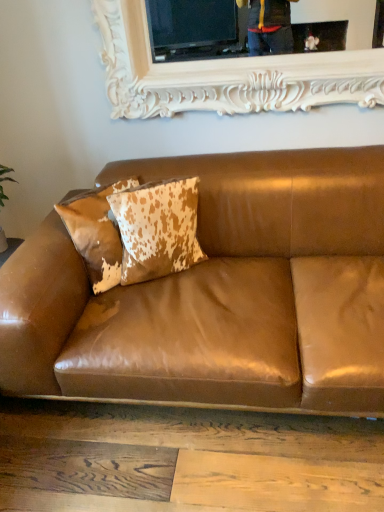
Question: Is there a large distance between cowhide pillow at upper left, acting as the 2th pillow starting from the left, and cowhide pillow at center, which is counted as the first pillow, starting from the left?

Choices:
 (A) no
 (B) yes

Answer: (A)

Question: Is cowhide pillow at upper left, the 1th pillow when ordered from right to left, next to cowhide pillow at center, which is counted as the first pillow, starting from the left, and touching it?

Choices:
 (A) yes
 (B) no

Answer: (B)

Question: Is cowhide pillow at upper left, the 1th pillow when ordered from right to left, facing towards cowhide pillow at center, which is counted as the first pillow, starting from the left?

Choices:
 (A) no
 (B) yes

Answer: (A)

Question: Is cowhide pillow at upper left, the 1th pillow when ordered from right to left, looking in the opposite direction of cowhide pillow at center, marked as the 2th pillow in a right-to-left arrangement?

Choices:
 (A) no
 (B) yes

Answer: (B)

Question: Does cowhide pillow at upper left, acting as the 2th pillow starting from the left, have a lesser height compared to cowhide pillow at center, marked as the 2th pillow in a right-to-left arrangement?

Choices:
 (A) yes
 (B) no

Answer: (B)

Question: Is point (150, 217) positioned closer to the camera than point (100, 202)?

Choices:
 (A) farther
 (B) closer

Answer: (B)

Question: Considering the relative positions of cowhide pillow at upper left, acting as the 2th pillow starting from the left, and cowhide pillow at center, which is counted as the first pillow, starting from the left, in the image provided, is cowhide pillow at upper left, acting as the 2th pillow starting from the left, to the left or to the right of cowhide pillow at center, which is counted as the first pillow, starting from the left,?

Choices:
 (A) right
 (B) left

Answer: (A)

Question: From a real-world perspective, is cowhide pillow at upper left, acting as the 2th pillow starting from the left, positioned above or below cowhide pillow at center, marked as the 2th pillow in a right-to-left arrangement?

Choices:
 (A) above
 (B) below

Answer: (A)

Question: Which is correct: cowhide pillow at upper left, acting as the 2th pillow starting from the left, is inside cowhide pillow at center, which is counted as the first pillow, starting from the left, or outside of it?

Choices:
 (A) inside
 (B) outside

Answer: (B)

Question: Choose the correct answer: Is cowhide pillow at upper left, the 1th pillow when ordered from right to left, inside white carved wood picture frame at upper center or outside it?

Choices:
 (A) inside
 (B) outside

Answer: (B)

Question: Relative to white carved wood picture frame at upper center, is cowhide pillow at upper left, acting as the 2th pillow starting from the left, in front or behind?

Choices:
 (A) front
 (B) behind

Answer: (A)

Question: In terms of width, does cowhide pillow at upper left, acting as the 2th pillow starting from the left, look wider or thinner when compared to white carved wood picture frame at upper center?

Choices:
 (A) thin
 (B) wide

Answer: (B)

Question: From a real-world perspective, is cowhide pillow at upper left, acting as the 2th pillow starting from the left, positioned above or below white carved wood picture frame at upper center?

Choices:
 (A) below
 (B) above

Answer: (A)

Question: From the image's perspective, is brown leather couch at center above or below cowhide pillow at upper left, the 1th pillow when ordered from right to left?

Choices:
 (A) above
 (B) below

Answer: (B)

Question: Considering the positions of brown leather couch at center and cowhide pillow at upper left, acting as the 2th pillow starting from the left, in the image, is brown leather couch at center bigger or smaller than cowhide pillow at upper left, acting as the 2th pillow starting from the left,?

Choices:
 (A) big
 (B) small

Answer: (A)